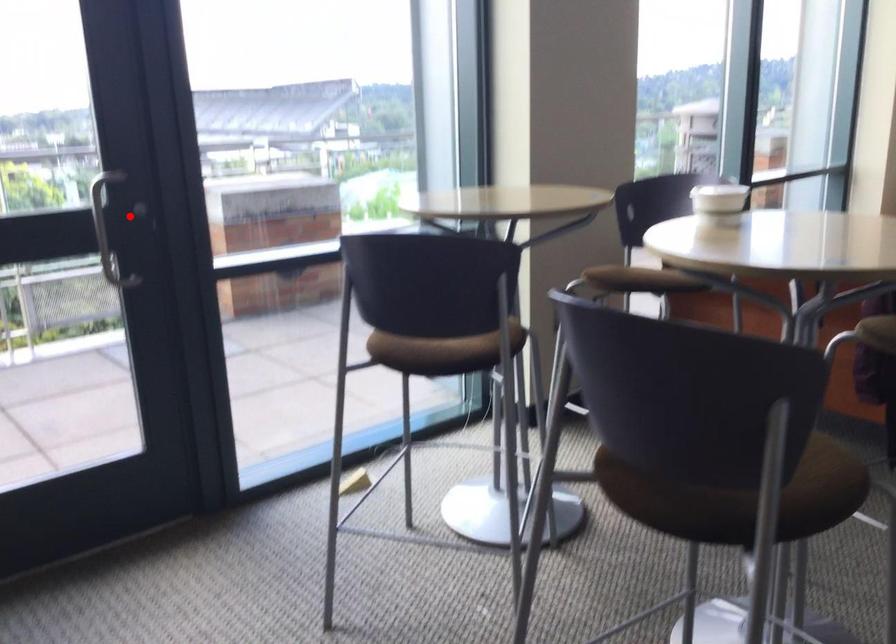
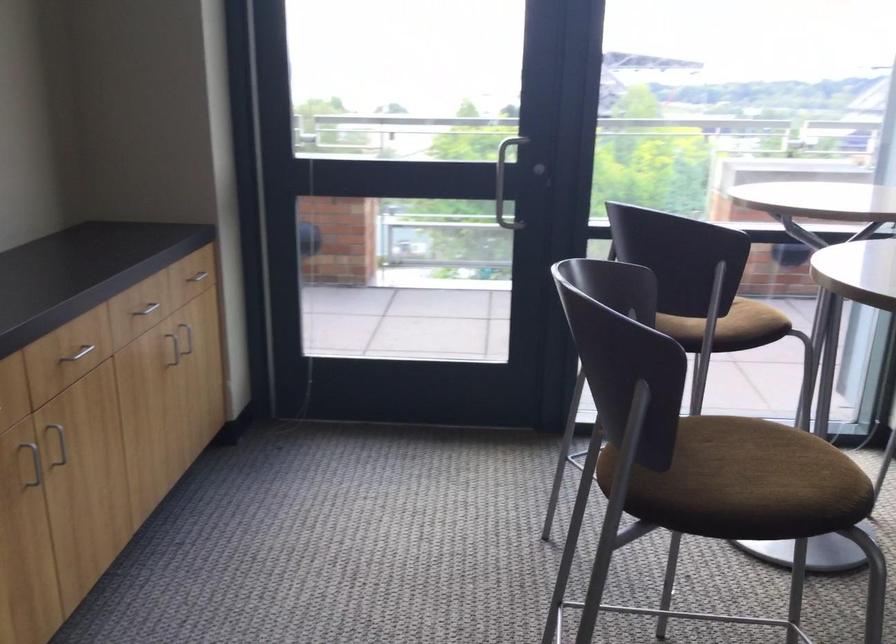
Question: I am providing you with two images of the same scene from different viewpoints. Image1 has a red point marked. In image2, the corresponding 3D location appears at what relative position? Reply with the corresponding letter.

Choices:
 (A) Closer
 (B) Farther

Answer: (B)